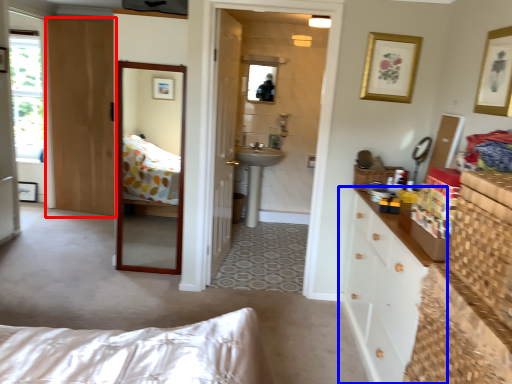
Question: Which of the following is the farthest to the observer, door (highlighted by a red box) or cabinetry (highlighted by a blue box)?

Choices:
 (A) door
 (B) cabinetry

Answer: (A)